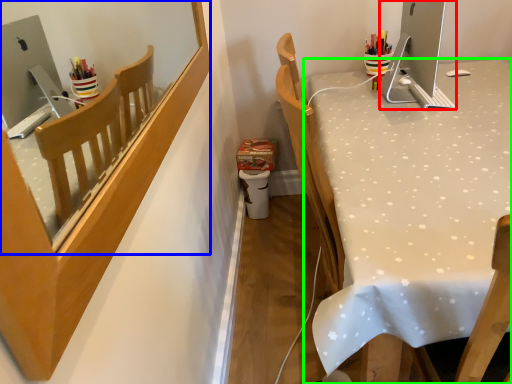
Question: Based on their relative distances, which object is nearer to desktop (highlighted by a red box)? Choose from mirror (highlighted by a blue box) and desk (highlighted by a green box).

Choices:
 (A) mirror
 (B) desk

Answer: (B)